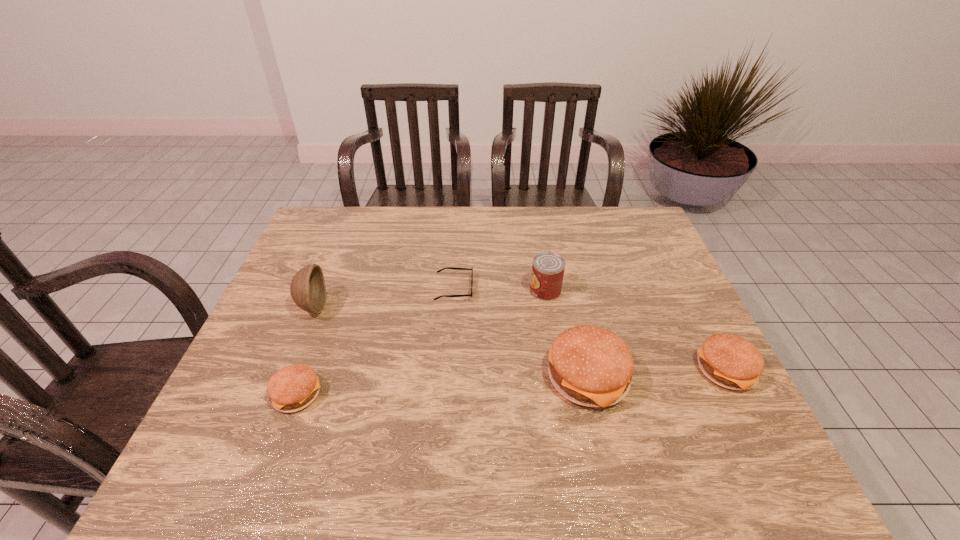
Locate an element on the screen. vacant space at the near edge is located at coordinates (389, 434).

Identify the location of vacant space at the left edge of the desktop. (309, 260).

The width and height of the screenshot is (960, 540). I want to click on vacant point at the right edge, so click(x=687, y=318).

I want to click on free region at the far left corner of the desktop, so click(x=350, y=234).

At what (x,y) coordinates should I click in order to perform the action: click on free space at the far right corner of the desktop. Please return your answer as a coordinate pair (x, y). The height and width of the screenshot is (540, 960). Looking at the image, I should click on (634, 210).

This screenshot has width=960, height=540. In order to click on vacant area that lies between the shortest hamburger and the can in this screenshot , I will do `click(421, 342)`.

Locate an element on the screen. This screenshot has width=960, height=540. vacant space in between the second shortest object and the sunglasses is located at coordinates (375, 341).

I want to click on empty space that is in between the can and the tallest object, so click(x=429, y=299).

This screenshot has width=960, height=540. I want to click on vacant space that's between the can and the leftmost hamburger, so click(421, 342).

Locate an element on the screen. blank region between the bowl and the can is located at coordinates (429, 299).